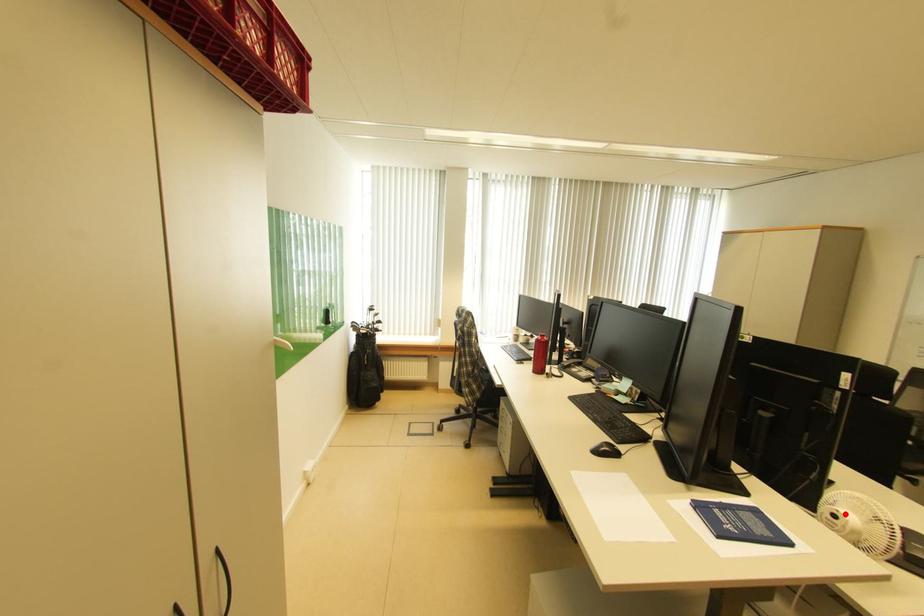
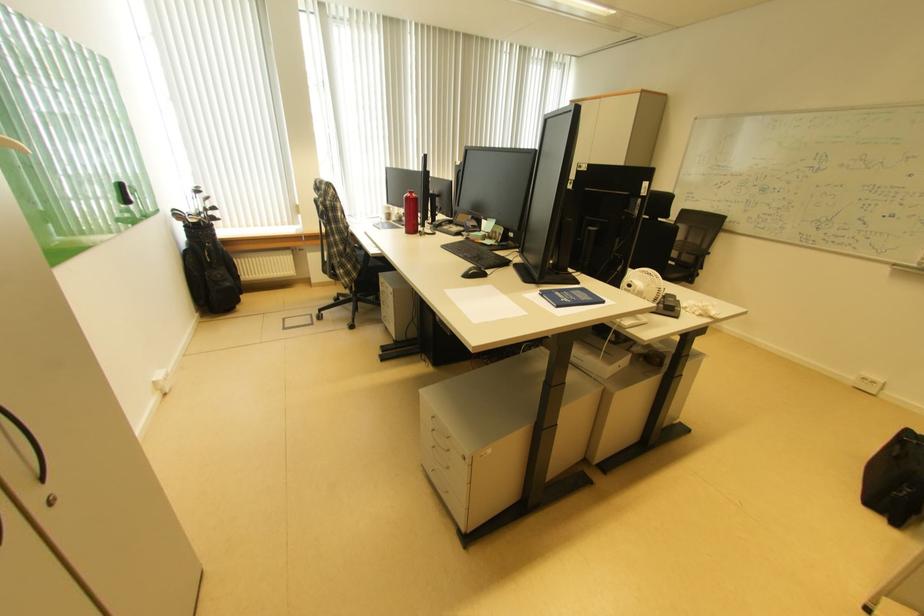
Question: I am providing you with two images of the same scene from different viewpoints. A red point is marked on the first image. At the location where the point appears in image 1, is it still visible in image 2?

Choices:
 (A) Yes
 (B) No

Answer: (A)